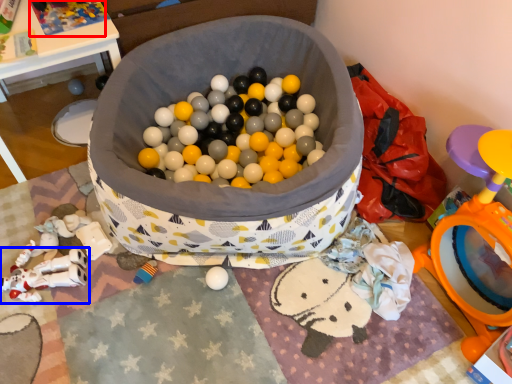
Question: Which point is further to the camera, toy (highlighted by a red box) or toy (highlighted by a blue box)?

Choices:
 (A) toy
 (B) toy

Answer: (A)